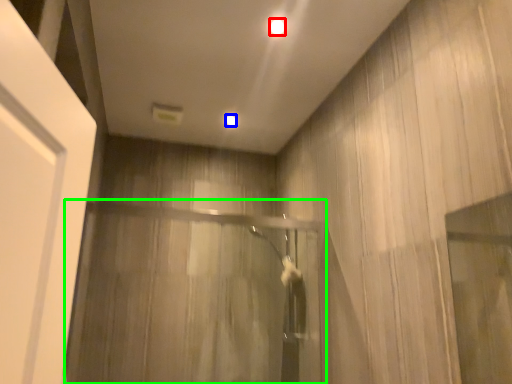
Question: Which object is the closest to the lighting (highlighted by a red box)? Choose among these: lighting (highlighted by a blue box) or screen door (highlighted by a green box).

Choices:
 (A) lighting
 (B) screen door

Answer: (A)